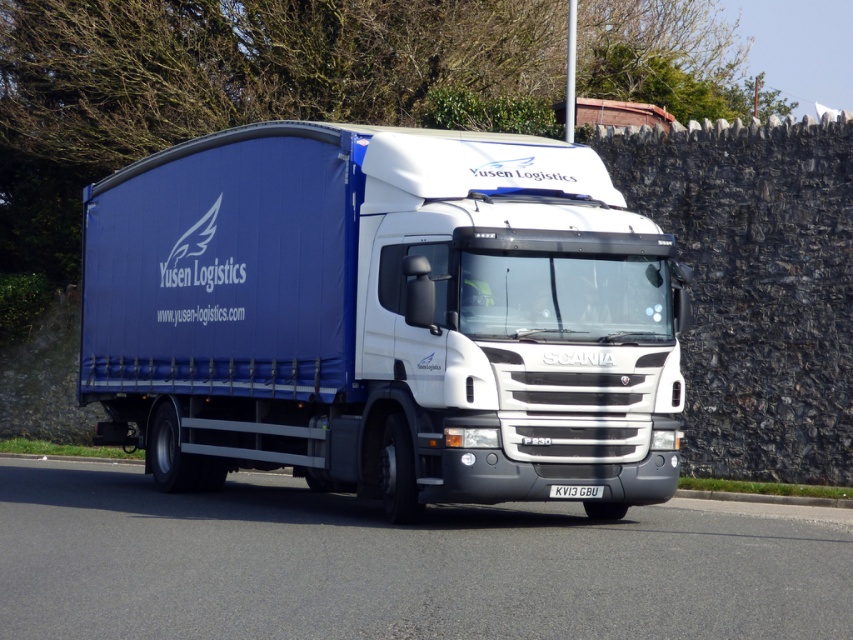
You are standing at the side of the road and see the Scania truck with Yusen Logistics branding moving along the road. There is a point marked at coordinates (399, 564). Where is this point located in relation to the truck?

The point at coordinates (399, 564) is located on the black asphalt road at center, which is the same location as the truck is moving along.

You are a delivery driver who needs to assess the distance between two points on the Scania truck to ensure safe loading. The points are point 1 at coordinates point (265, 404) and point 2 at coordinates point (579, 486). Which point is closer to you as you stand in front of the truck?

Point (265, 404) is closer to you than point (579, 486) because it is further to the viewer.

You are a delivery driver who needs to park your Scania truck with the Yusen Logistics branding on a narrow alley that is only 3 meters wide. The alley is too narrow to open the truck doors. Can you safely park the truck so that both the black asphalt road at center and the white plastic license plate at center are visible from the outside without opening any doors?

The distance between the black asphalt road at center and the white plastic license plate at center is 2.80 meters. Since the alley is 3 meters wide, which is slightly wider than the distance between them, you can park the truck safely so both are visible without opening doors.